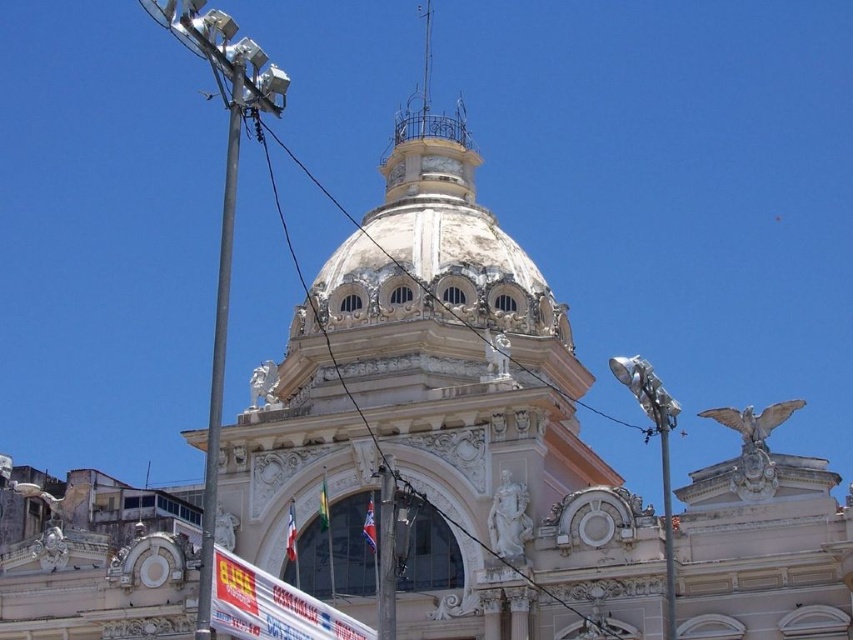
Between white glossy banner at lower center and white wire at center, which one has more height?

With more height is white wire at center.

Between white glossy banner at lower center and white wire at center, which one is positioned lower?

white glossy banner at lower center is below.

Is point (212, 580) positioned before point (338, 205)?

Yes, point (212, 580) is closer to viewer.

Locate an element on the screen. white glossy banner at lower center is located at coordinates (271, 605).

Between point (251, 632) and point (674, 604), which one is positioned in front?

Positioned in front is point (251, 632).

Who is taller, white glossy banner at lower center or metallic pole at right?

metallic pole at right

Locate an element on the screen. white glossy banner at lower center is located at coordinates (271, 605).

Is point (456, 556) positioned before point (531, 371)?

Yes, point (456, 556) is closer to viewer.

Based on the photo, can you confirm if white stone dome at center is positioned to the left of white wire at center?

In fact, white stone dome at center is to the right of white wire at center.

Does point (527, 426) lie behind point (548, 385)?

No, it is in front of (548, 385).

At what (x,y) coordinates should I click in order to perform the action: click on white stone dome at center. Please return your answer as a coordinate pair (x, y). The width and height of the screenshot is (853, 640). Looking at the image, I should click on (438, 428).